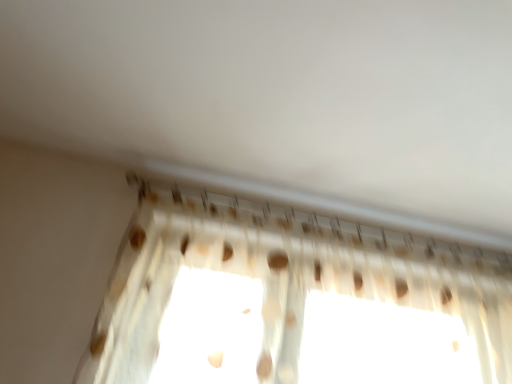
The height and width of the screenshot is (384, 512). Describe the element at coordinates (286, 277) in the screenshot. I see `translucent fabric curtain at upper center` at that location.

The image size is (512, 384). In order to click on translucent fabric curtain at upper center in this screenshot , I will do `click(286, 277)`.

Identify the location of translucent fabric curtain at upper center. (286, 277).